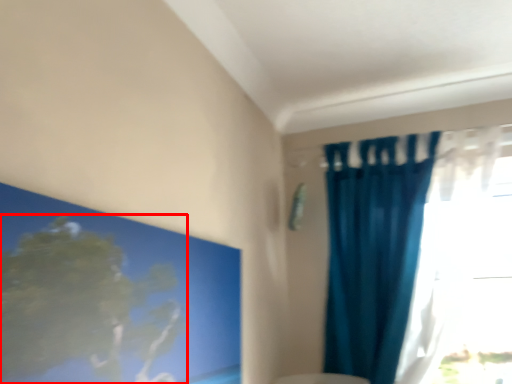
Question: From the image's perspective, where is tree (annotated by the red box) located relative to curtain?

Choices:
 (A) below
 (B) above

Answer: (A)